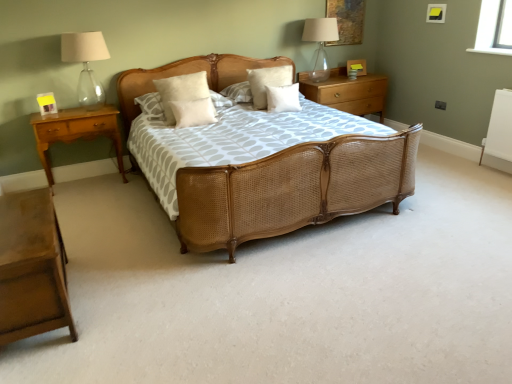
At what (x,y) coordinates should I click in order to perform the action: click on free space to the right of light brown wood nightstand at lower left, acting as the second nightstand starting from the right. Please return your answer as a coordinate pair (x, y). This screenshot has height=384, width=512. Looking at the image, I should click on (138, 302).